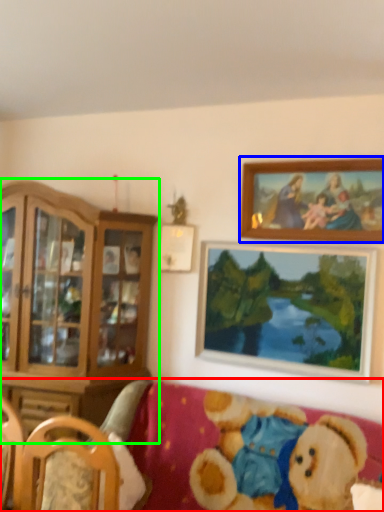
Question: Estimate the real-world distances between objects in this image. Which object is closer to studio couch (highlighted by a red box), picture frame (highlighted by a blue box) or cabinetry (highlighted by a green box)?

Choices:
 (A) picture frame
 (B) cabinetry

Answer: (B)